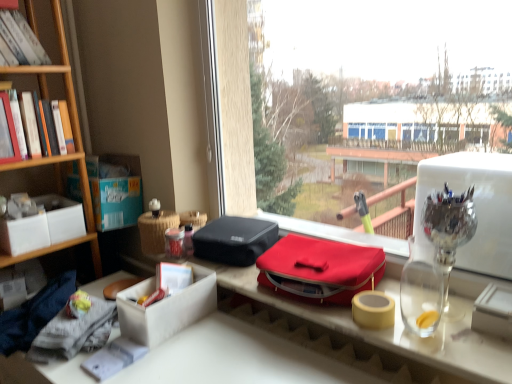
In order to click on vacant area that lies to the right of yellow matte adhesive tape at right in this screenshot , I will do `click(439, 317)`.